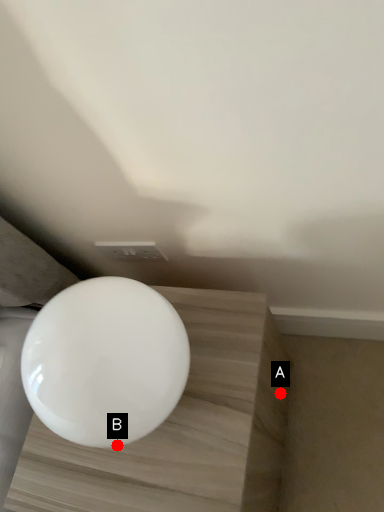
Question: Two points are circled on the image, labeled by A and B beside each circle. Which point appears closest to the camera in this image?

Choices:
 (A) A is closer
 (B) B is closer

Answer: (B)